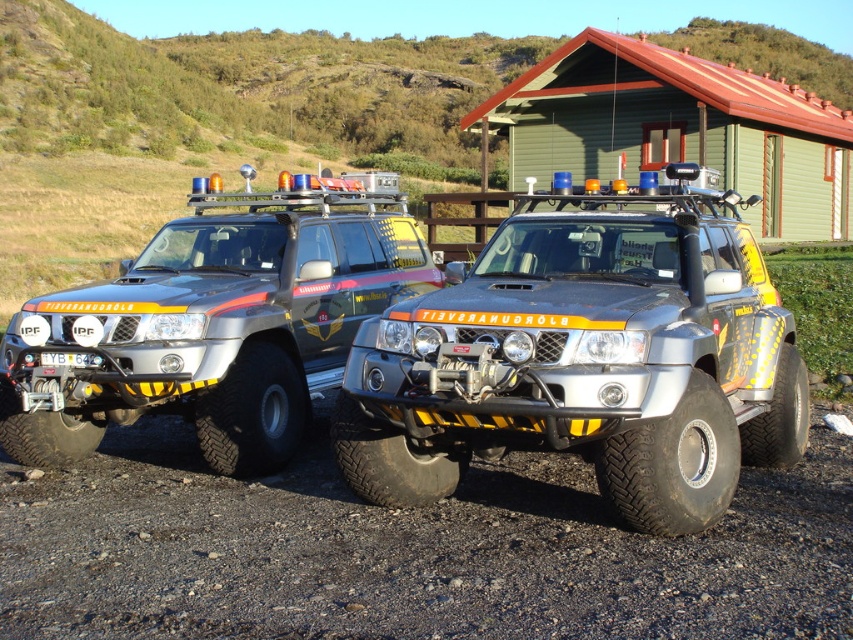
Looking at this image, you are standing at the point marked by coordinates point (409,552). Looking around, you see two Nissan Patrol off road vehicles parked side by side on a gravel surface. Which direction should you face to see the dirt track at lower left?

The point marked by coordinates point (409,552) is the dirt track at lower left itself, so you are already facing it.